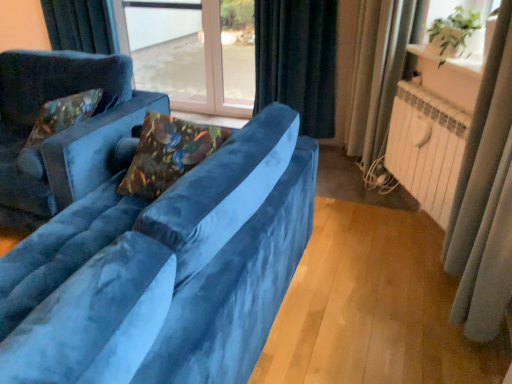
In order to click on free spot below silky gray curtain at right, the third curtain viewed from the back (from a real-world perspective) in this screenshot , I will do `click(473, 344)`.